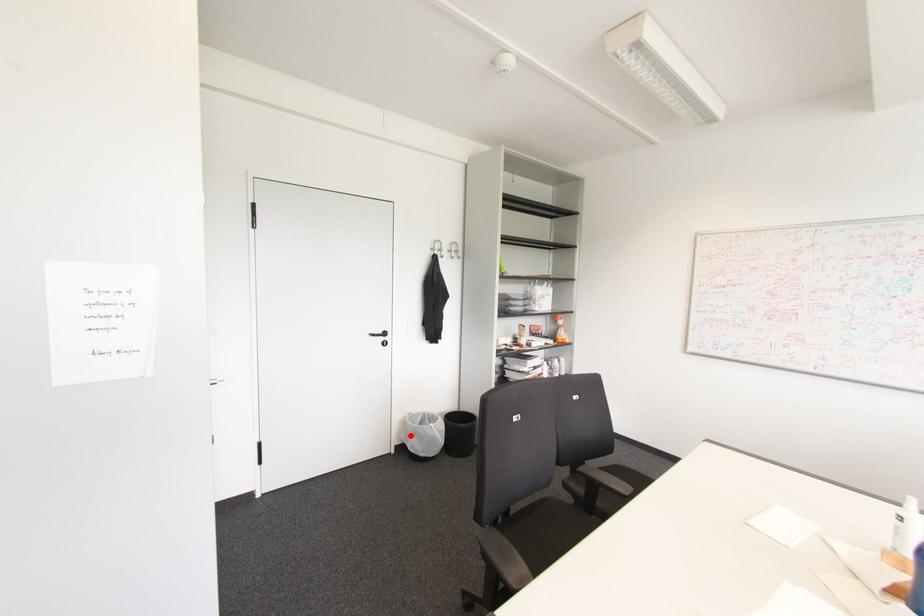
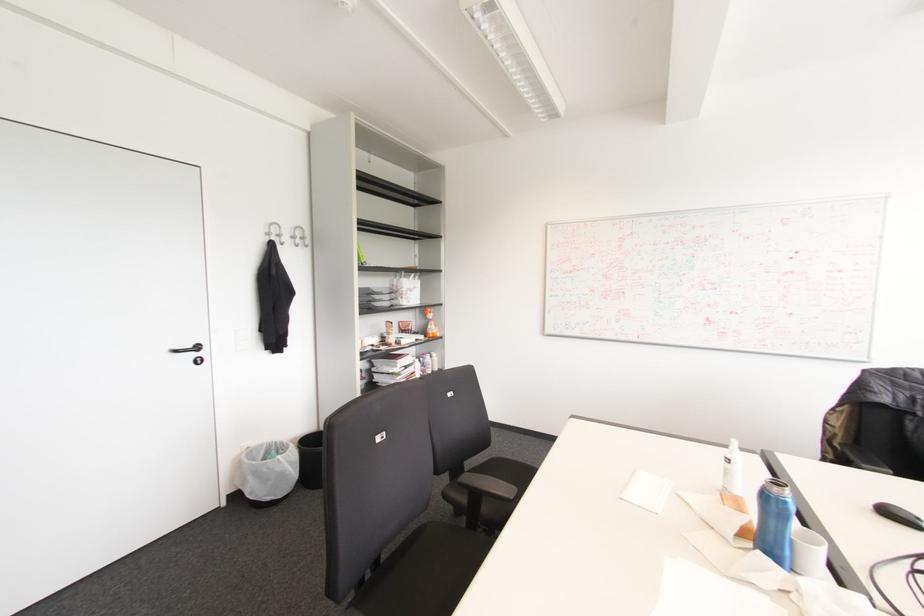
Question: I am providing you with two images of the same scene from different viewpoints. A red point is marked on the first image. Is the red point's position out of view in image 2?

Choices:
 (A) Yes
 (B) No

Answer: (B)